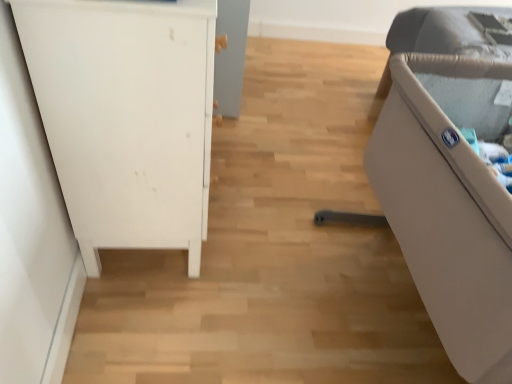
Question: Should I look upward or downward to see white matte cabinet at left, positioned as the 1th furniture in left-to-right order?

Choices:
 (A) up
 (B) down

Answer: (A)

Question: Considering the relative sizes of white matte cabinet at left, which is the second furniture in right-to-left order, and beige plastic crib at right, the second furniture from the left, in the image provided, is white matte cabinet at left, which is the second furniture in right-to-left order, wider than beige plastic crib at right, the second furniture from the left,?

Choices:
 (A) no
 (B) yes

Answer: (A)

Question: Is white matte cabinet at left, which is the second furniture in right-to-left order, taller than beige plastic crib at right, the second furniture from the left?

Choices:
 (A) yes
 (B) no

Answer: (A)

Question: From the image's perspective, is white matte cabinet at left, which is the second furniture in right-to-left order, under beige plastic crib at right, the 1th furniture when ordered from right to left?

Choices:
 (A) no
 (B) yes

Answer: (A)

Question: Considering the relative positions of white matte cabinet at left, which is the second furniture in right-to-left order, and beige plastic crib at right, the 1th furniture when ordered from right to left, in the image provided, is white matte cabinet at left, which is the second furniture in right-to-left order, behind beige plastic crib at right, the 1th furniture when ordered from right to left,?

Choices:
 (A) no
 (B) yes

Answer: (B)

Question: Is white matte cabinet at left, positioned as the 1th furniture in left-to-right order, surrounding beige plastic crib at right, the 1th furniture when ordered from right to left?

Choices:
 (A) no
 (B) yes

Answer: (A)

Question: Would you consider white matte cabinet at left, positioned as the 1th furniture in left-to-right order, to be distant from beige plastic crib at right, the second furniture from the left?

Choices:
 (A) no
 (B) yes

Answer: (A)

Question: From a real-world perspective, is beige plastic crib at right, the 1th furniture when ordered from right to left, over white matte cabinet at left, which is the second furniture in right-to-left order?

Choices:
 (A) yes
 (B) no

Answer: (B)

Question: From the image's perspective, does beige plastic crib at right, the 1th furniture when ordered from right to left, appear higher than white matte cabinet at left, which is the second furniture in right-to-left order?

Choices:
 (A) no
 (B) yes

Answer: (A)

Question: Is the depth of beige plastic crib at right, the 1th furniture when ordered from right to left, greater than that of white matte cabinet at left, positioned as the 1th furniture in left-to-right order?

Choices:
 (A) no
 (B) yes

Answer: (A)

Question: Can you confirm if beige plastic crib at right, the 1th furniture when ordered from right to left, is thinner than white matte cabinet at left, which is the second furniture in right-to-left order?

Choices:
 (A) yes
 (B) no

Answer: (B)

Question: From a real-world perspective, is beige plastic crib at right, the second furniture from the left, positioned under white matte cabinet at left, positioned as the 1th furniture in left-to-right order, based on gravity?

Choices:
 (A) no
 (B) yes

Answer: (B)

Question: Is beige plastic crib at right, the 1th furniture when ordered from right to left, positioned in front of white matte cabinet at left, which is the second furniture in right-to-left order?

Choices:
 (A) yes
 (B) no

Answer: (A)

Question: From the image's perspective, is beige plastic crib at right, the 1th furniture when ordered from right to left, positioned above or below white matte cabinet at left, which is the second furniture in right-to-left order?

Choices:
 (A) above
 (B) below

Answer: (B)